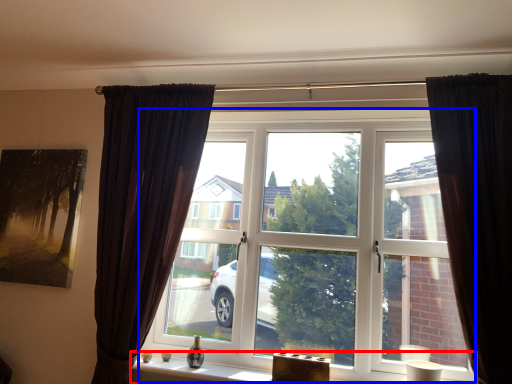
Question: Which of the following is the farthest to the observer, window sill (highlighted by a red box) or window (highlighted by a blue box)?

Choices:
 (A) window sill
 (B) window

Answer: (B)